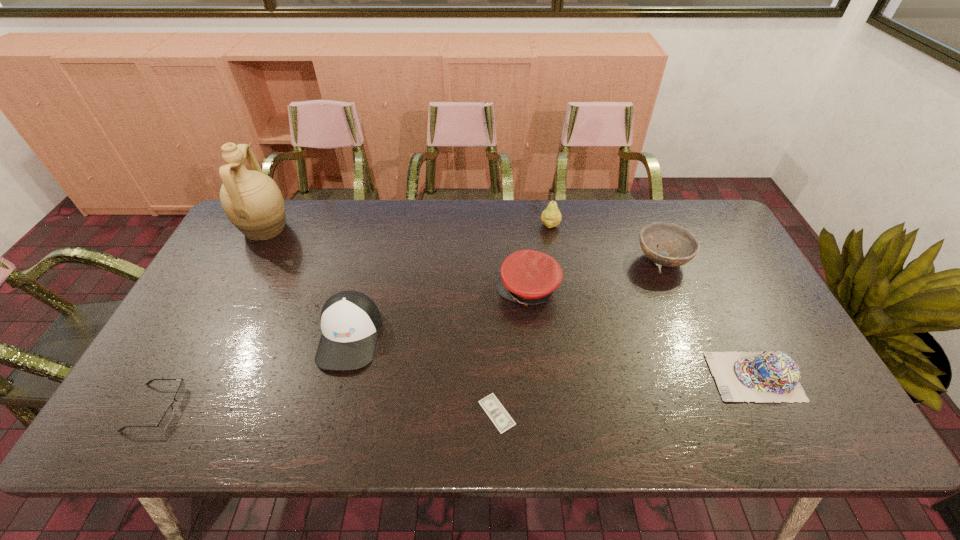
Identify the location of vacant space located on the front of the pitcher. The width and height of the screenshot is (960, 540). (200, 353).

Identify the location of vacant space located on the back of the pear. (547, 206).

At what (x,y) coordinates should I click in order to perform the action: click on vacant space located on the front panel of the leftmost cap. Please return your answer as a coordinate pair (x, y). Looking at the image, I should click on (334, 400).

Identify the location of free space located 0.120m on the front of the second cap from right to left with an emblem. (454, 290).

Locate an element on the screen. Image resolution: width=960 pixels, height=540 pixels. vacant space located 0.350m on the front of the second cap from right to left with an emblem is located at coordinates (374, 290).

The width and height of the screenshot is (960, 540). What are the coordinates of `blank space located 0.320m on the front of the second cap from right to left with an emblem` in the screenshot? It's located at (385, 290).

Identify the location of free space located on the front of the bowl. tap(713, 384).

Where is `vacant space located on the front, side, and top of the shortest cap`? The width and height of the screenshot is (960, 540). vacant space located on the front, side, and top of the shortest cap is located at coordinates (553, 376).

You are a GUI agent. You are given a task and a screenshot of the screen. Output one action in this format:
    pyautogui.click(x=<x>, y=<y>)
    Task: Click on the vacant area located on the front, side, and top of the shortest cap
    The height and width of the screenshot is (540, 960).
    Given the screenshot: What is the action you would take?
    pos(638,376)

What are the coordinates of `free space located on the front, side, and top of the shortest cap` in the screenshot? It's located at (663, 376).